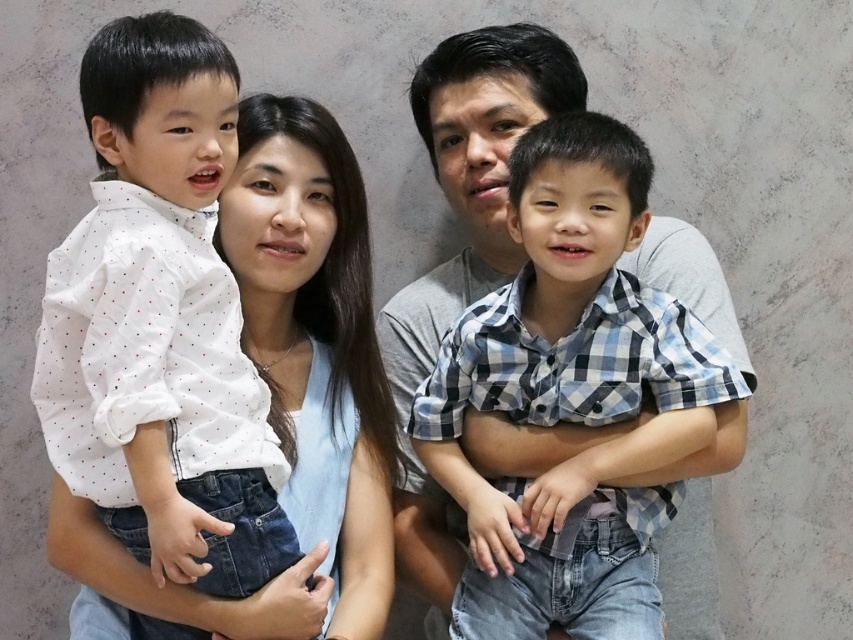
Question: Among these objects, which one is farthest from the camera?

Choices:
 (A) checkered fabric shirt at center
 (B) matte white shirt at left

Answer: (B)

Question: Does checkered fabric shirt at center come in front of matte white shirt at left?

Choices:
 (A) yes
 (B) no

Answer: (A)

Question: Among these objects, which one is nearest to the camera?

Choices:
 (A) checkered fabric shirt at center
 (B) matte white shirt at left

Answer: (A)

Question: Can you confirm if checkered fabric shirt at center is wider than matte white shirt at left?

Choices:
 (A) yes
 (B) no

Answer: (B)

Question: Considering the relative positions of checkered fabric shirt at center and matte white shirt at left in the image provided, where is checkered fabric shirt at center located with respect to matte white shirt at left?

Choices:
 (A) above
 (B) below

Answer: (B)